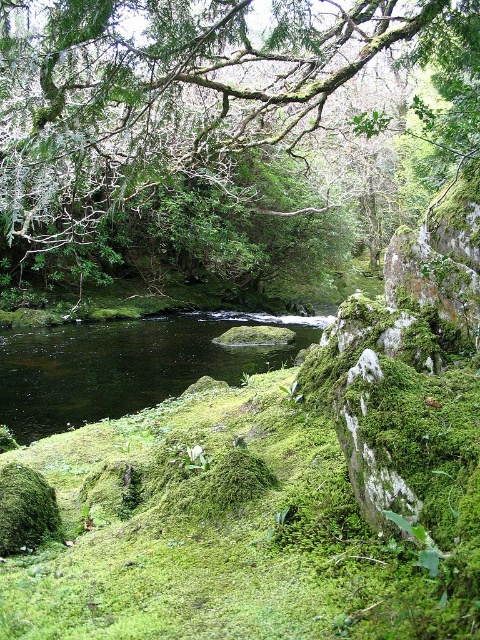
Between point (319, 8) and point (4, 472), which one is positioned behind?

The point (319, 8) is more distant.

I want to click on green mossy branch at upper center, so click(x=168, y=97).

Who is positioned more to the right, green mossy branch at upper center or black liquid water at center?

green mossy branch at upper center

Is green mossy branch at upper center to the left of black liquid water at center from the viewer's perspective?

No, green mossy branch at upper center is not to the left of black liquid water at center.

You are a GUI agent. You are given a task and a screenshot of the screen. Output one action in this format:
    pyautogui.click(x=<x>, y=<y>)
    Task: Click on the green mossy branch at upper center
    The width and height of the screenshot is (480, 640).
    Given the screenshot: What is the action you would take?
    pyautogui.click(x=168, y=97)

Is black liquid water at center positioned before green mossy rock at lower left?

No, black liquid water at center is behind green mossy rock at lower left.

Which is in front, point (68, 390) or point (26, 547)?

Point (26, 547)

Image resolution: width=480 pixels, height=640 pixels. Identify the location of black liquid water at center. pos(126,365).